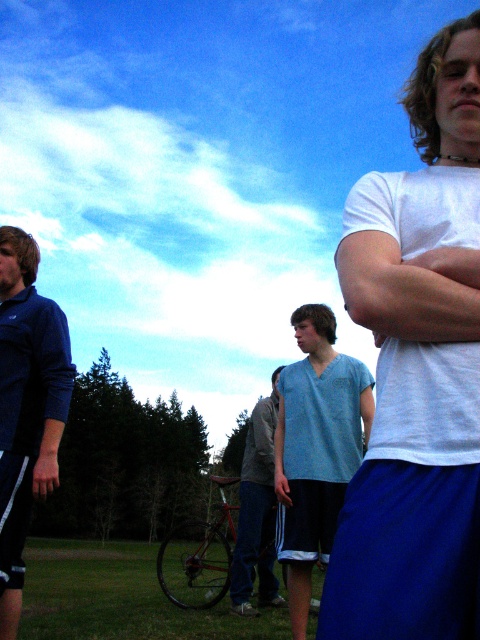
Question: Observing the image, what is the correct spatial positioning of dark blue jersey at left in reference to light blue cotton shirt at center?

Choices:
 (A) left
 (B) right

Answer: (A)

Question: Where is white matte t-shirt at right located in relation to light blue fabric shirt at center in the image?

Choices:
 (A) below
 (B) above

Answer: (B)

Question: Which point appears closest to the camera in this image?

Choices:
 (A) (242, 483)
 (B) (447, 161)
 (C) (362, 365)

Answer: (B)

Question: Which point is closer to the camera?

Choices:
 (A) (355, 416)
 (B) (471, 566)

Answer: (B)

Question: Which of these objects is positioned farthest from the light blue fabric at center?

Choices:
 (A) light blue cotton shirt at center
 (B) white matte t-shirt at right
 (C) dark blue jersey at left

Answer: (B)

Question: Is light blue fabric shirt at center wider than dark blue jersey at left?

Choices:
 (A) yes
 (B) no

Answer: (A)